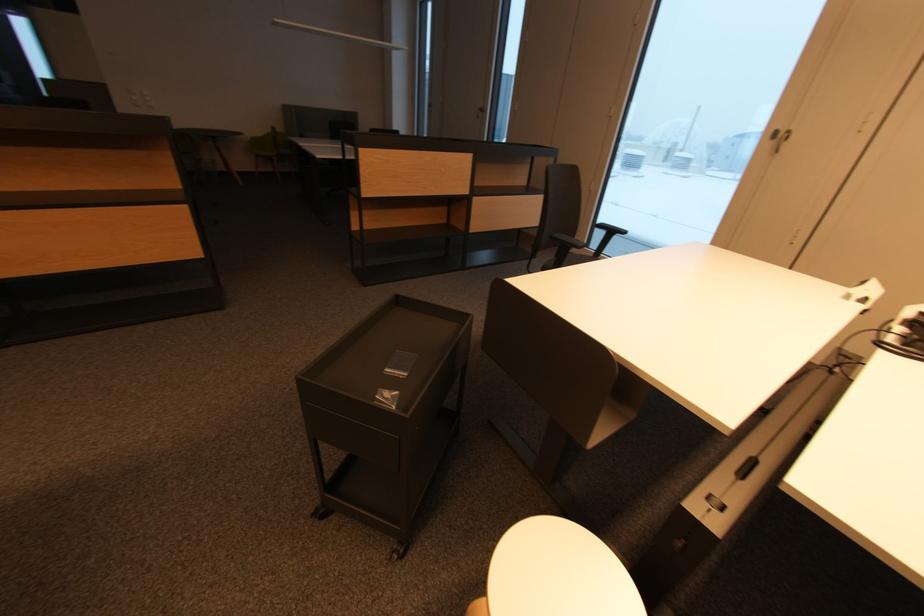
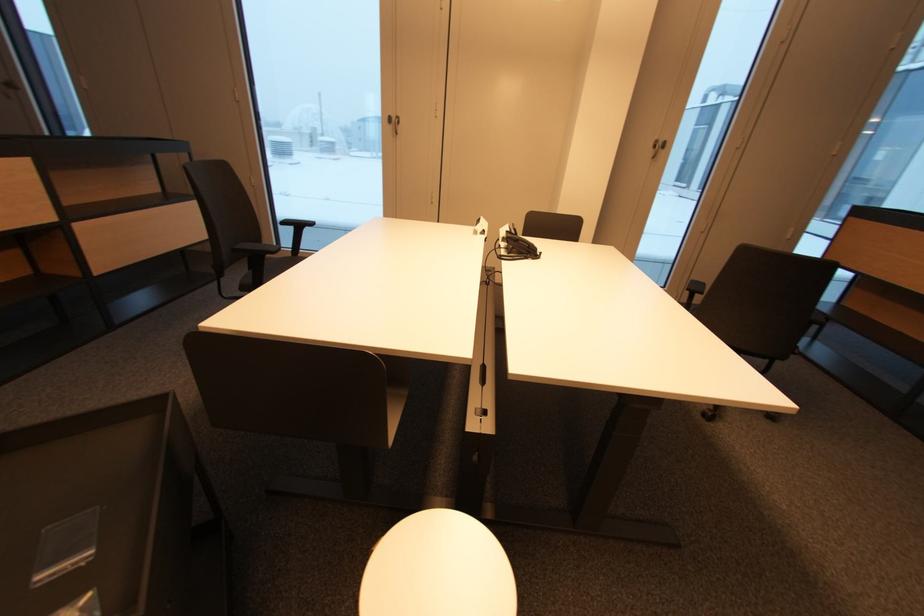
Question: The camera is either moving clockwise (left) or counter-clockwise (right) around the object. The first image is from the beginning of the video and the second image is from the end. Is the camera moving left or right when shooting the video?

Choices:
 (A) Left
 (B) Right

Answer: (A)